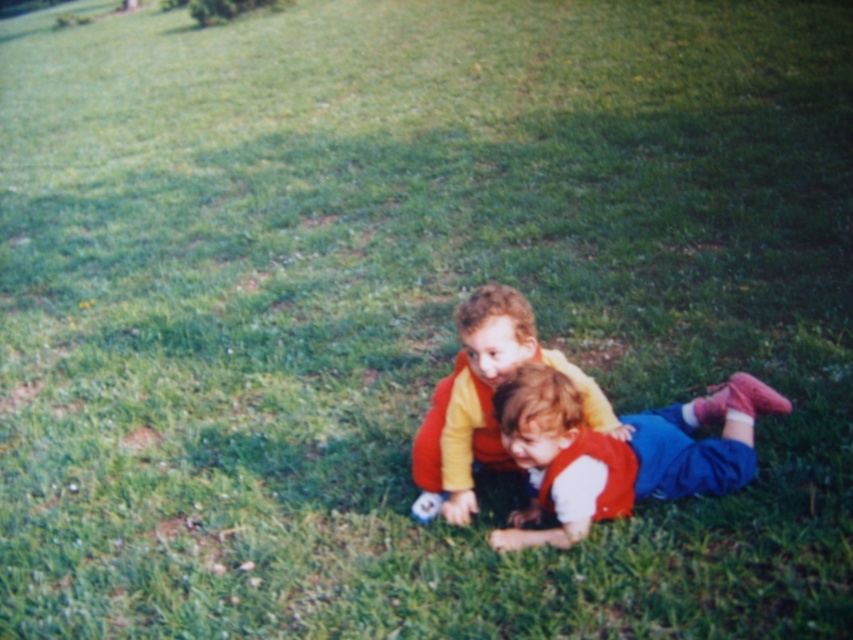
Question: Is matte red vest at center smaller than matte yellow shirt at center?

Choices:
 (A) yes
 (B) no

Answer: (B)

Question: Does matte red vest at center have a smaller size compared to matte yellow shirt at center?

Choices:
 (A) no
 (B) yes

Answer: (A)

Question: Which object is farther from the camera taking this photo?

Choices:
 (A) matte red vest at center
 (B) matte yellow shirt at center

Answer: (B)

Question: Where is matte red vest at center located in relation to matte yellow shirt at center in the image?

Choices:
 (A) below
 (B) above

Answer: (A)